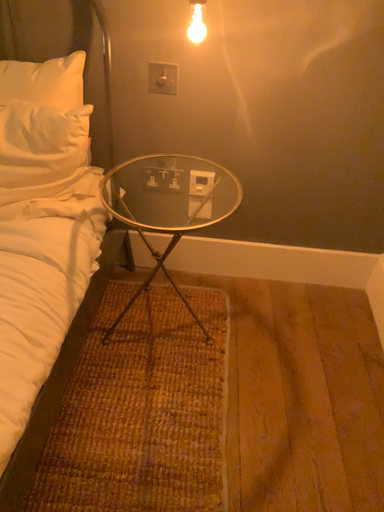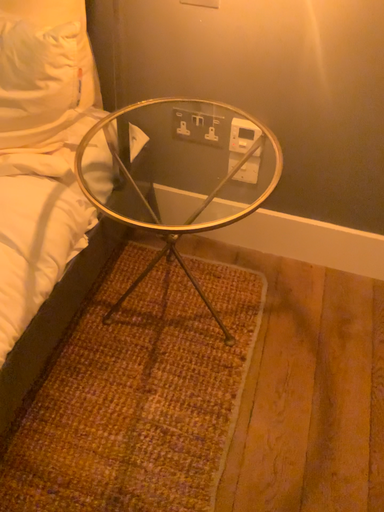
Question: Which way did the camera rotate in the video?

Choices:
 (A) rotated right
 (B) rotated left

Answer: (B)